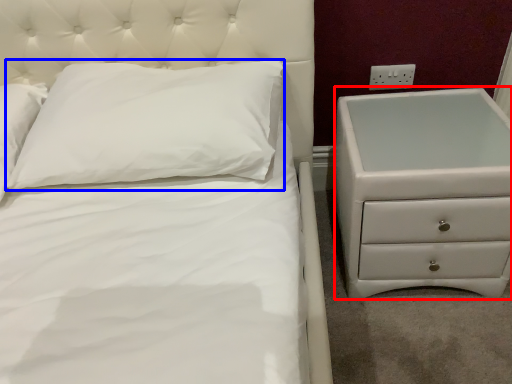
Question: Which object is closer to the camera taking this photo, chest of drawers (highlighted by a red box) or pillow (highlighted by a blue box)?

Choices:
 (A) chest of drawers
 (B) pillow

Answer: (B)